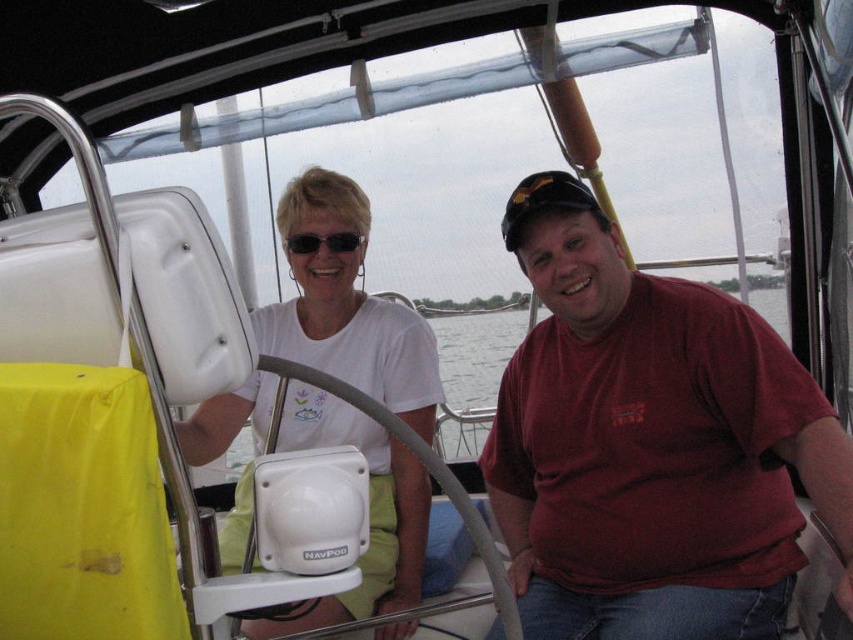
Question: Which point appears farthest from the camera in this image?

Choices:
 (A) (405, 506)
 (B) (469, 390)
 (C) (344, 250)
 (D) (590, 435)

Answer: (B)

Question: Which point appears farthest from the camera in this image?

Choices:
 (A) (265, 337)
 (B) (692, 554)
 (C) (354, 232)

Answer: (A)

Question: Is clear water at steering wheel right thinner than matte black sunglasses at upper center?

Choices:
 (A) no
 (B) yes

Answer: (A)

Question: Estimate the real-world distances between objects in this image. Which object is farther from the clear water at steering wheel right?

Choices:
 (A) white matte steering wheel at center
 (B) matte black sunglasses at upper center

Answer: (B)

Question: Does red matte shirt at center have a larger size compared to white matte steering wheel at center?

Choices:
 (A) no
 (B) yes

Answer: (A)

Question: Is white matte steering wheel at center below clear water at steering wheel right?

Choices:
 (A) no
 (B) yes

Answer: (B)